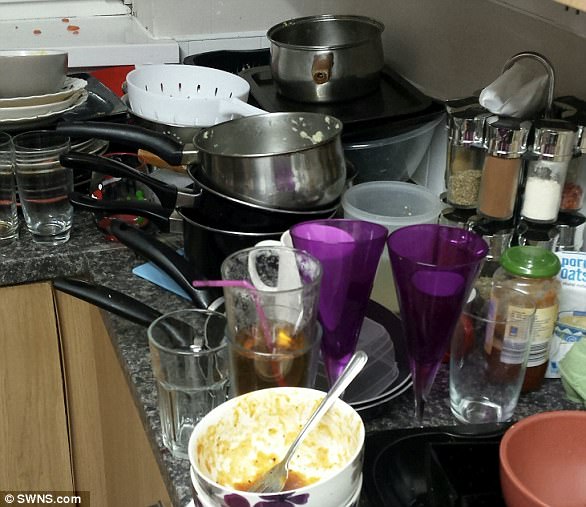
Identify the location of grey counter top. The image size is (586, 507). (108, 271), (91, 234).